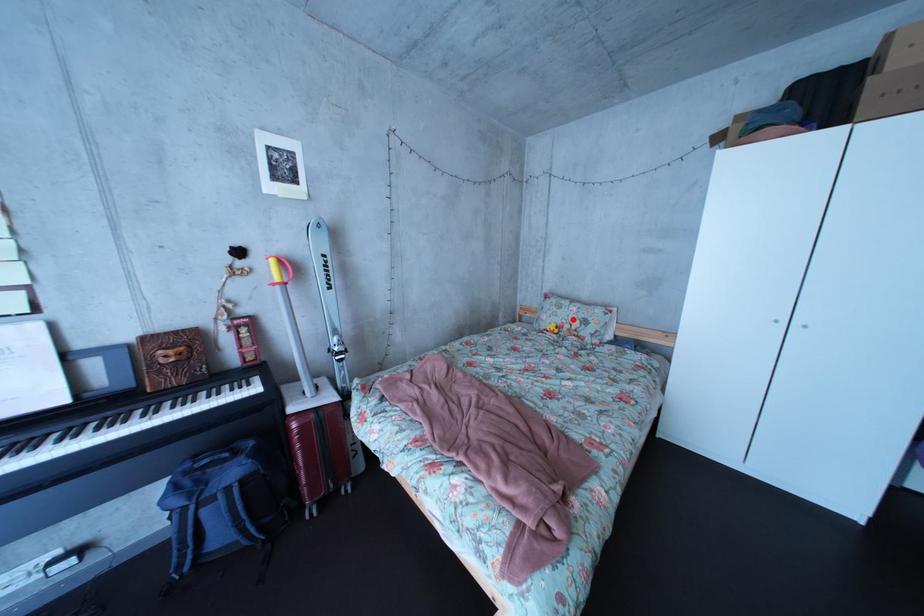
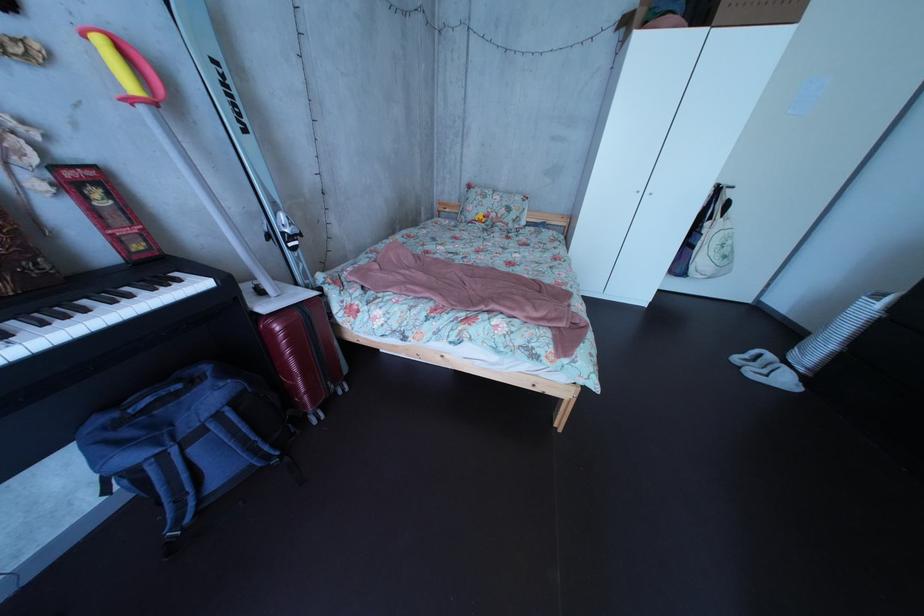
Question: I am providing you with two images of the same scene from different viewpoints. Image1 has a red point marked. In image2, the corresponding 3D location appears at what relative position? Reply with the corresponding letter.

Choices:
 (A) Closer
 (B) Farther

Answer: (A)